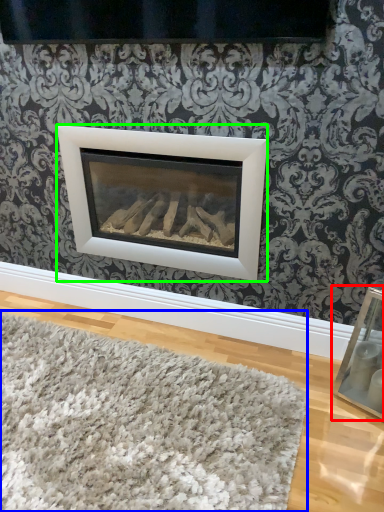
Question: Which is farther away from picture frame (highlighted by a red box)? mat (highlighted by a blue box) or fireplace (highlighted by a green box)?

Choices:
 (A) mat
 (B) fireplace

Answer: (B)